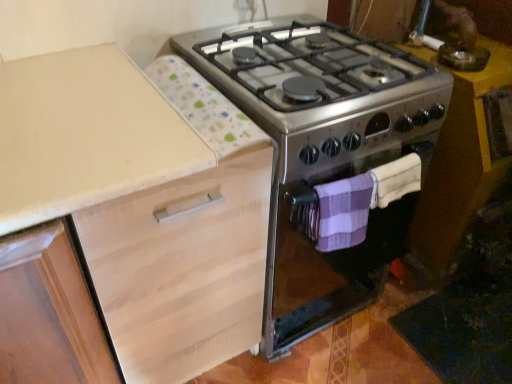
Question: Is light wood cabinet at upper left closer to camera compared to purple striped towel at lower right, placed as the 1th blanket when sorted from left to right?

Choices:
 (A) yes
 (B) no

Answer: (A)

Question: Is light wood cabinet at upper left aimed at purple striped towel at lower right, placed as the 1th blanket when sorted from left to right?

Choices:
 (A) no
 (B) yes

Answer: (A)

Question: Does light wood cabinet at upper left appear on the left side of purple striped towel at lower right, placed as the 1th blanket when sorted from left to right?

Choices:
 (A) no
 (B) yes

Answer: (B)

Question: Does light wood cabinet at upper left have a greater width compared to purple striped towel at lower right, arranged as the second blanket when viewed from the right?

Choices:
 (A) yes
 (B) no

Answer: (A)

Question: Are light wood cabinet at upper left and purple striped towel at lower right, arranged as the second blanket when viewed from the right, located far from each other?

Choices:
 (A) no
 (B) yes

Answer: (A)

Question: From the image's perspective, is light wood cabinet at upper left over purple striped towel at lower right, placed as the 1th blanket when sorted from left to right?

Choices:
 (A) no
 (B) yes

Answer: (A)

Question: Considering the relative positions of stainless steel stove at center and purple striped towel at lower right, arranged as the second blanket when viewed from the right, in the image provided, is stainless steel stove at center to the left of purple striped towel at lower right, arranged as the second blanket when viewed from the right, from the viewer's perspective?

Choices:
 (A) yes
 (B) no

Answer: (A)

Question: Can you confirm if stainless steel stove at center is smaller than purple striped towel at lower right, placed as the 1th blanket when sorted from left to right?

Choices:
 (A) no
 (B) yes

Answer: (A)

Question: From the image's perspective, is stainless steel stove at center on purple striped towel at lower right, arranged as the second blanket when viewed from the right?

Choices:
 (A) no
 (B) yes

Answer: (B)

Question: Is stainless steel stove at center not within purple striped towel at lower right, arranged as the second blanket when viewed from the right?

Choices:
 (A) yes
 (B) no

Answer: (A)

Question: Could you tell me if stainless steel stove at center is turned towards purple striped towel at lower right, placed as the 1th blanket when sorted from left to right?

Choices:
 (A) yes
 (B) no

Answer: (A)

Question: Is stainless steel stove at center in front of purple striped towel at lower right, arranged as the second blanket when viewed from the right?

Choices:
 (A) yes
 (B) no

Answer: (B)

Question: From the image's perspective, is metallic yellow table at right located above purple knitted towel at lower right, which is counted as the 2th blanket, starting from the left?

Choices:
 (A) no
 (B) yes

Answer: (B)